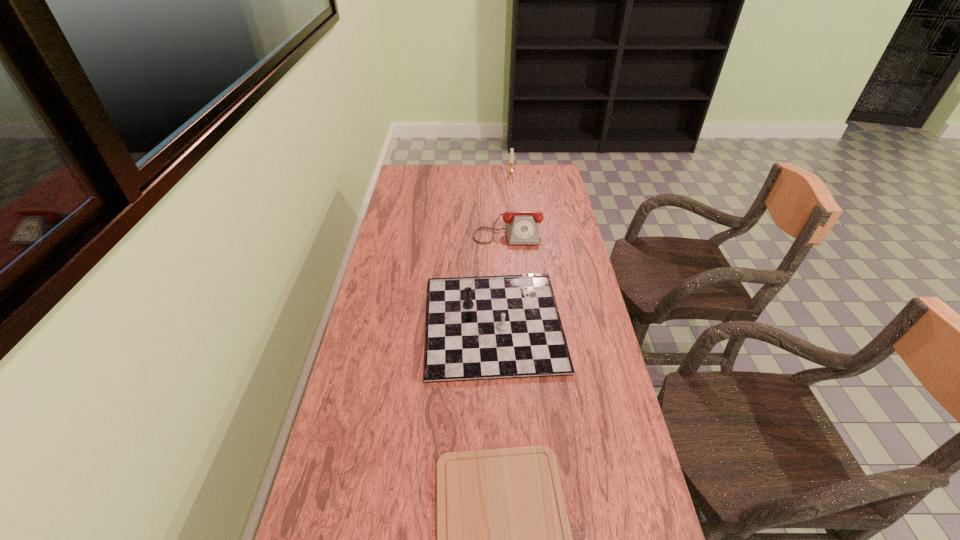
Where is `candle holder`? candle holder is located at coordinates (511, 169).

At what (x,y) coordinates should I click in order to perform the action: click on the tallest object. Please return your answer as a coordinate pair (x, y). The image size is (960, 540). Looking at the image, I should click on (511, 169).

This screenshot has height=540, width=960. Identify the location of the third nearest object. (522, 228).

Identify the location of the third farthest object. This screenshot has width=960, height=540. (488, 327).

Identify the location of vacant area located on the left of the candle holder. (468, 171).

Locate an element on the screen. free region located on the dial of the third nearest object is located at coordinates (511, 265).

At what (x,y) coordinates should I click in order to perform the action: click on vacant region located 0.070m on the front of the second nearest object. Please return your answer as a coordinate pair (x, y). The height and width of the screenshot is (540, 960). Looking at the image, I should click on (496, 406).

What are the coordinates of `object that is positioned at the far edge` in the screenshot? It's located at (511, 169).

Identify the location of telephone at the right edge. The width and height of the screenshot is (960, 540). (522, 228).

At what (x,y) coordinates should I click in order to perform the action: click on gameboard present at the right edge. Please return your answer as a coordinate pair (x, y). Image resolution: width=960 pixels, height=540 pixels. Looking at the image, I should click on (488, 327).